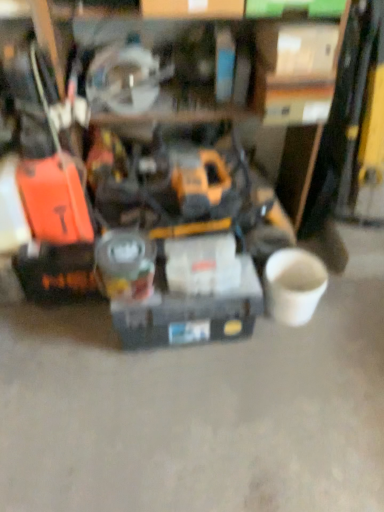
Question: Should I look upward or downward to see matte gray toolbox at center, the first box from the left?

Choices:
 (A) up
 (B) down

Answer: (B)

Question: Is white cardboard box at upper center, the first box from the top, at the left side of yellow/black plastic drill at center?

Choices:
 (A) no
 (B) yes

Answer: (A)

Question: From the image's perspective, is white cardboard box at upper center, which is the first box in right-to-left order, over yellow/black plastic drill at center?

Choices:
 (A) yes
 (B) no

Answer: (A)

Question: From the image's perspective, is white cardboard box at upper center, the first box from the top, under yellow/black plastic drill at center?

Choices:
 (A) no
 (B) yes

Answer: (A)

Question: Does white cardboard box at upper center, the first box from the top, have a lesser height compared to yellow/black plastic drill at center?

Choices:
 (A) no
 (B) yes

Answer: (B)

Question: Considering the relative sizes of white cardboard box at upper center, which ranks as the second box in left-to-right order, and yellow/black plastic drill at center in the image provided, is white cardboard box at upper center, which ranks as the second box in left-to-right order, thinner than yellow/black plastic drill at center?

Choices:
 (A) yes
 (B) no

Answer: (A)

Question: From a real-world perspective, is white cardboard box at upper center, which is the first box in right-to-left order, over yellow/black plastic drill at center?

Choices:
 (A) no
 (B) yes

Answer: (B)

Question: Considering the relative sizes of yellow/black plastic drill at center and matte gray toolbox at center, which is the second box in top-to-bottom order, in the image provided, is yellow/black plastic drill at center bigger than matte gray toolbox at center, which is the second box in top-to-bottom order,?

Choices:
 (A) yes
 (B) no

Answer: (A)

Question: Could you tell me if yellow/black plastic drill at center is turned towards matte gray toolbox at center, the 2th box in the right-to-left sequence?

Choices:
 (A) no
 (B) yes

Answer: (B)

Question: Is yellow/black plastic drill at center closer to camera compared to matte gray toolbox at center, the 2th box in the right-to-left sequence?

Choices:
 (A) no
 (B) yes

Answer: (B)

Question: Is yellow/black plastic drill at center positioned with its back to matte gray toolbox at center, the first box from the left?

Choices:
 (A) no
 (B) yes

Answer: (A)

Question: Does yellow/black plastic drill at center appear on the left side of matte gray toolbox at center, positioned as the first box in bottom-to-top order?

Choices:
 (A) yes
 (B) no

Answer: (B)

Question: Is yellow/black plastic drill at center shorter than matte gray toolbox at center, positioned as the first box in bottom-to-top order?

Choices:
 (A) yes
 (B) no

Answer: (B)

Question: Is matte gray toolbox at center, the 2th box in the right-to-left sequence, inside white cardboard box at upper center, which ranks as the second box in left-to-right order?

Choices:
 (A) no
 (B) yes

Answer: (A)